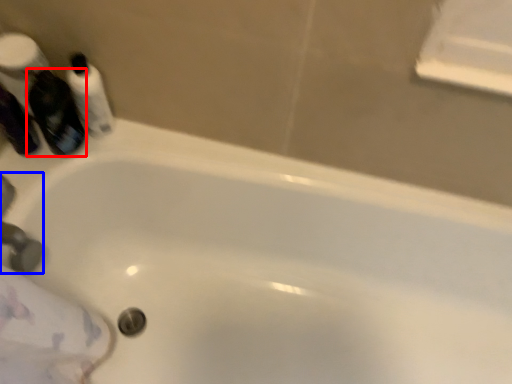
Question: Which point is further to the camera, mouthwash (highlighted by a red box) or faucet (highlighted by a blue box)?

Choices:
 (A) mouthwash
 (B) faucet

Answer: (A)